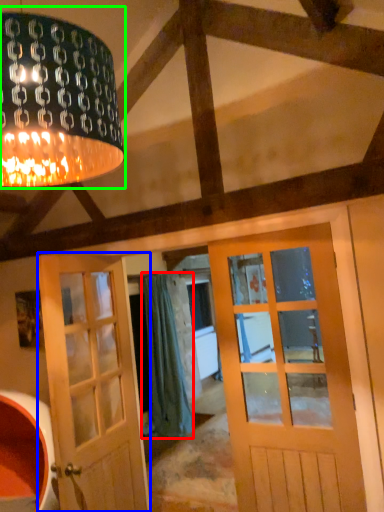
Question: Which object is positioned farthest from curtain (highlighted by a red box)? Select from door (highlighted by a blue box) and lamp (highlighted by a green box).

Choices:
 (A) door
 (B) lamp

Answer: (B)